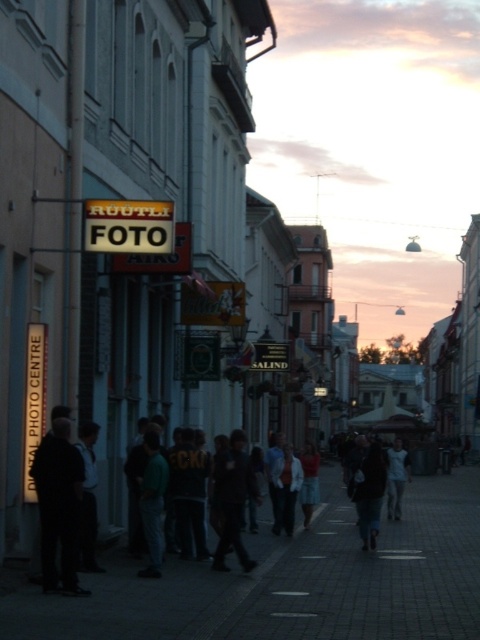
Based on the photo, you are a pedestrian standing on the dark gray concrete sidewalk at center. You notice dark blue jeans at center nearby. Based on the scene description, where exactly are the dark blue jeans located relative to the sidewalk?

The dark blue jeans at center are located above the dark gray concrete sidewalk at center, as the sidewalk is positioned under the jeans.

You are a delivery person with a 1.2 meter wide cart. You need to navigate through the street scene shown. Can your cart fit between the dark gray concrete sidewalk at center and the dark blue jeans at center?

The dark gray concrete sidewalk at center is wider than the dark blue jeans at center. Since the cart is 1.2 meters wide, it depends on the actual width of the sidewalk. However, the description only states that the sidewalk is wider than the jeans but doesn

You are standing on the dark gray concrete sidewalk at center. Looking around, you notice the RUTLI FOTO building with its signs. Can you determine the direction of the sun based on the shadows cast by the buildings?

The sun is in the west because the shadows are cast towards the east, which is typical during dusk when the sun is setting in the west.